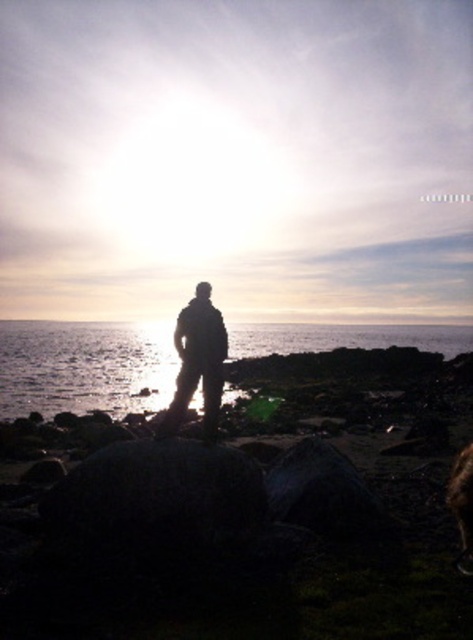
Based on the photo, you are a photographer trying to capture the transparent water at center in your shot. However, you notice the fuzzy brown dog at lower right might block your view. Based on their positions, will the dog obstruct the water in the photo?

The fuzzy brown dog at lower right is behind transparent water at center, so it will not obstruct the view of the transparent water at center in the photo.

You are a photographer planning to capture the reflection of the sunset in the transparent water at center. However, you notice the silhouette fabric at center might interfere. Based on their sizes, which object would dominate the reflection area?

The transparent water at center is larger in size than the silhouette fabric at center, so the transparent water at center would dominate the reflection area.

You are standing at the camera position and want to reach point (409, 332). Is the distance more than 500 feet?

Yes, the distance between the camera and point (409, 332) is 568.89 feet, which is more than 500 feet.